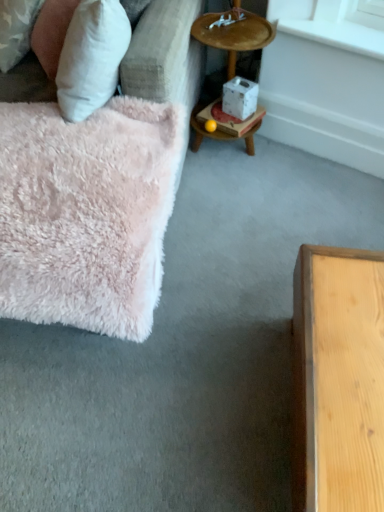
Question: Is white smooth window sill at upper right wider or thinner than wooden tray at upper right?

Choices:
 (A) thin
 (B) wide

Answer: (A)

Question: In the image, is white smooth window sill at upper right positioned in front of or behind wooden tray at upper right?

Choices:
 (A) behind
 (B) front

Answer: (A)

Question: Which of these objects is positioned farthest from the white fluffy pillow at upper left?

Choices:
 (A) white cardboard box at center
 (B) white smooth window sill at upper right
 (C) fluffy pink rug at left
 (D) wooden tray at upper right

Answer: (B)

Question: Considering the real-world distances, which object is farthest from the white cardboard box at center?

Choices:
 (A) white smooth window sill at upper right
 (B) fluffy pink rug at left
 (C) wooden tray at upper right
 (D) white fluffy pillow at upper left

Answer: (B)